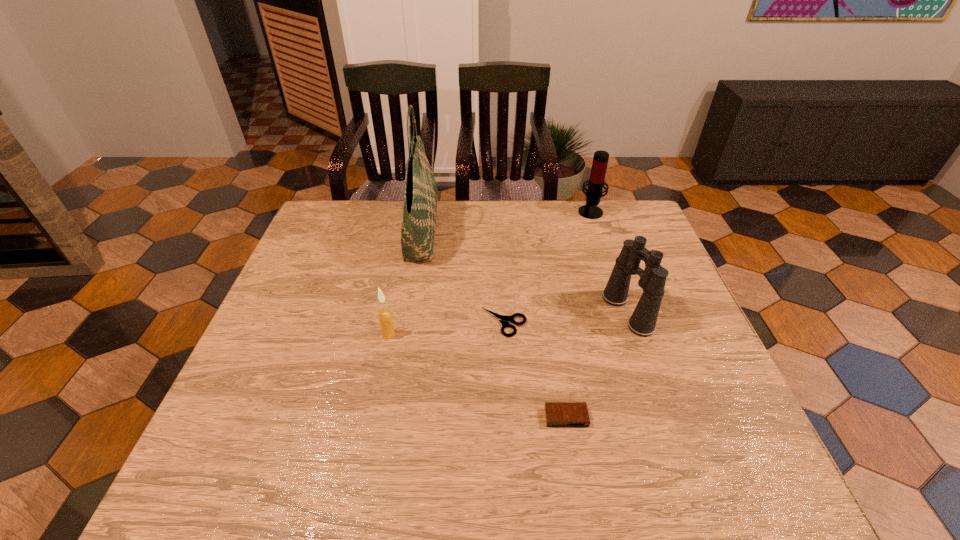
The image size is (960, 540). In order to click on vacant space positioned 0.180m on the left of the binoculars in this screenshot , I will do `click(536, 312)`.

I want to click on vacant area situated on the back of the third shortest object, so click(x=399, y=280).

Locate an element on the screen. The height and width of the screenshot is (540, 960). free location located 0.110m on the front face of the alarm clock is located at coordinates [x=577, y=482].

This screenshot has height=540, width=960. I want to click on vacant space located 0.170m on the left of the shears, so click(413, 323).

The width and height of the screenshot is (960, 540). I want to click on tote bag that is at the far edge, so click(x=420, y=192).

Locate an element on the screen. This screenshot has width=960, height=540. microphone at the far edge is located at coordinates (x=594, y=193).

Find the location of a particular element. microphone present at the right edge is located at coordinates (594, 193).

You are a GUI agent. You are given a task and a screenshot of the screen. Output one action in this format:
    pyautogui.click(x=<x>, y=<y>)
    Task: Click on the binoculars situated at the right edge
    Image resolution: width=960 pixels, height=540 pixels.
    Given the screenshot: What is the action you would take?
    pyautogui.click(x=652, y=280)

Locate an element on the screen. The image size is (960, 540). object that is at the far right corner is located at coordinates (594, 193).

In the image, there is a desktop. At what (x,y) coordinates should I click in order to perform the action: click on free space at the far edge. Please return your answer as a coordinate pair (x, y). Looking at the image, I should click on (541, 227).